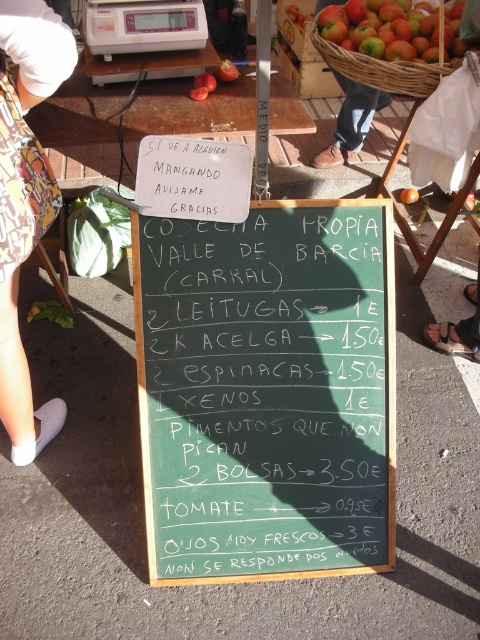
Which of these two, white fabric at lower left or orange matte tomato at center, stands taller?

With more height is white fabric at lower left.

Can you confirm if white fabric at lower left is wider than orange matte tomato at center?

Yes.

The image size is (480, 640). Describe the element at coordinates (25, 202) in the screenshot. I see `white fabric at lower left` at that location.

The width and height of the screenshot is (480, 640). Find the location of `white fabric at lower left`. white fabric at lower left is located at coordinates (25, 202).

Is white fabric at lower left positioned before ripe red apples at upper right?

Yes, it is.

Does white fabric at lower left appear on the right side of ripe red apples at upper right?

In fact, white fabric at lower left is to the left of ripe red apples at upper right.

Find the location of `white fabric at lower left`. white fabric at lower left is located at coordinates (25, 202).

Between point (346, 212) and point (410, 196), which one is positioned in front?

Positioned in front is point (346, 212).

Between green chalkboard at center and orange matte tomato at center, which one has less height?

orange matte tomato at center

In the scene shown: Who is more forward, (177, 326) or (400, 196)?

Point (177, 326)

The height and width of the screenshot is (640, 480). In order to click on green chalkboard at center in this screenshot , I will do `click(266, 392)`.